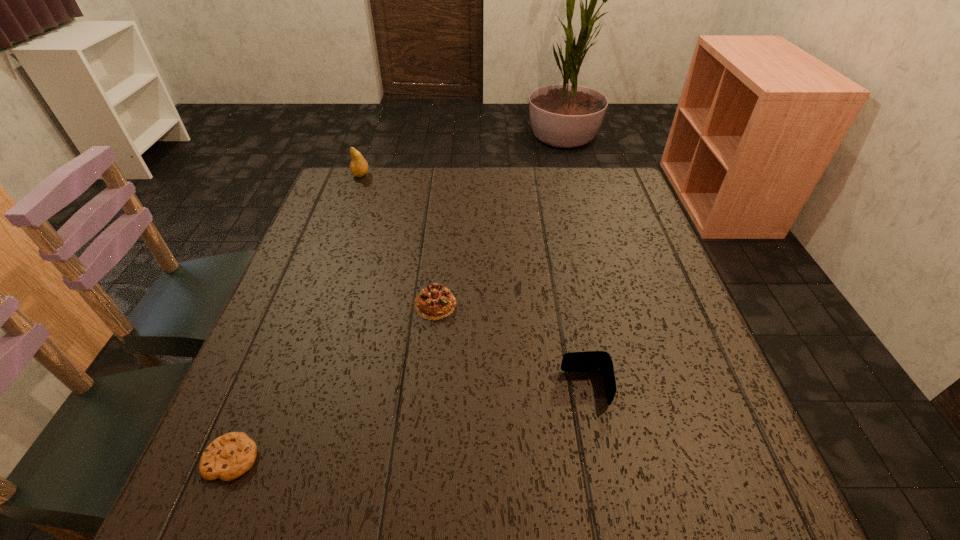
The height and width of the screenshot is (540, 960). Identify the location of free point at the far edge. (451, 177).

In the image, there is a desktop. Identify the location of vacant space at the near edge. (369, 519).

I want to click on free space at the left edge of the desktop, so click(x=293, y=423).

Identify the location of vacant space at the right edge. The image size is (960, 540). (616, 227).

Where is `free space at the far left corner of the desktop`? free space at the far left corner of the desktop is located at coordinates (382, 187).

Identify the location of vacant space that is in between the third shortest object and the third object from left to right. Image resolution: width=960 pixels, height=540 pixels. (510, 346).

Identify the location of empty location between the third nearest object and the shortest object. The height and width of the screenshot is (540, 960). (333, 381).

You are a GUI agent. You are given a task and a screenshot of the screen. Output one action in this format:
    pyautogui.click(x=<x>, y=<y>)
    Task: Click on the free space between the pear and the rightmost object
    Image resolution: width=960 pixels, height=540 pixels.
    Given the screenshot: What is the action you would take?
    pyautogui.click(x=473, y=281)

Locate an element on the screen. Image resolution: width=960 pixels, height=540 pixels. unoccupied area between the second nearest object and the second object from right to left is located at coordinates (510, 346).

Locate an element on the screen. unoccupied area between the pear and the cookie is located at coordinates (297, 316).